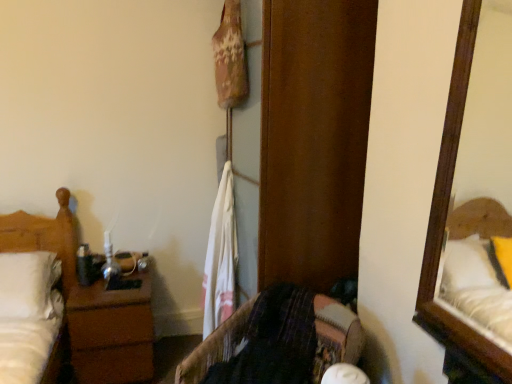
Question: Considering the relative sizes of velvet-like fabric chair at center and white matte bed at left in the image provided, is velvet-like fabric chair at center bigger than white matte bed at left?

Choices:
 (A) no
 (B) yes

Answer: (B)

Question: Can you confirm if velvet-like fabric chair at center is shorter than white matte bed at left?

Choices:
 (A) no
 (B) yes

Answer: (B)

Question: Is velvet-like fabric chair at center far away from white matte bed at left?

Choices:
 (A) no
 (B) yes

Answer: (B)

Question: Could you tell me if velvet-like fabric chair at center is facing white matte bed at left?

Choices:
 (A) yes
 (B) no

Answer: (B)

Question: Is velvet-like fabric chair at center oriented away from white matte bed at left?

Choices:
 (A) yes
 (B) no

Answer: (B)

Question: In terms of size, does brown wood nightstand at left appear bigger or smaller than velvet-like fabric chair at center?

Choices:
 (A) small
 (B) big

Answer: (A)

Question: Relative to velvet-like fabric chair at center, is brown wood nightstand at left in front or behind?

Choices:
 (A) behind
 (B) front

Answer: (A)

Question: From a real-world perspective, is brown wood nightstand at left positioned above or below velvet-like fabric chair at center?

Choices:
 (A) below
 (B) above

Answer: (A)

Question: From their relative heights in the image, would you say brown wood nightstand at left is taller or shorter than velvet-like fabric chair at center?

Choices:
 (A) short
 (B) tall

Answer: (A)

Question: From a real-world perspective, is white matte bed at left positioned above or below white cotton towel at center?

Choices:
 (A) below
 (B) above

Answer: (A)

Question: Would you say white matte bed at left is inside or outside white cotton towel at center?

Choices:
 (A) inside
 (B) outside

Answer: (B)

Question: In terms of height, does white matte bed at left look taller or shorter compared to white cotton towel at center?

Choices:
 (A) short
 (B) tall

Answer: (A)

Question: Is white matte bed at left wider or thinner than white cotton towel at center?

Choices:
 (A) wide
 (B) thin

Answer: (A)

Question: Considering the positions of point (209, 279) and point (339, 329), is point (209, 279) closer or farther from the camera than point (339, 329)?

Choices:
 (A) closer
 (B) farther

Answer: (B)

Question: From the image's perspective, is white cotton towel at center located above or below velvet-like fabric chair at center?

Choices:
 (A) above
 (B) below

Answer: (A)